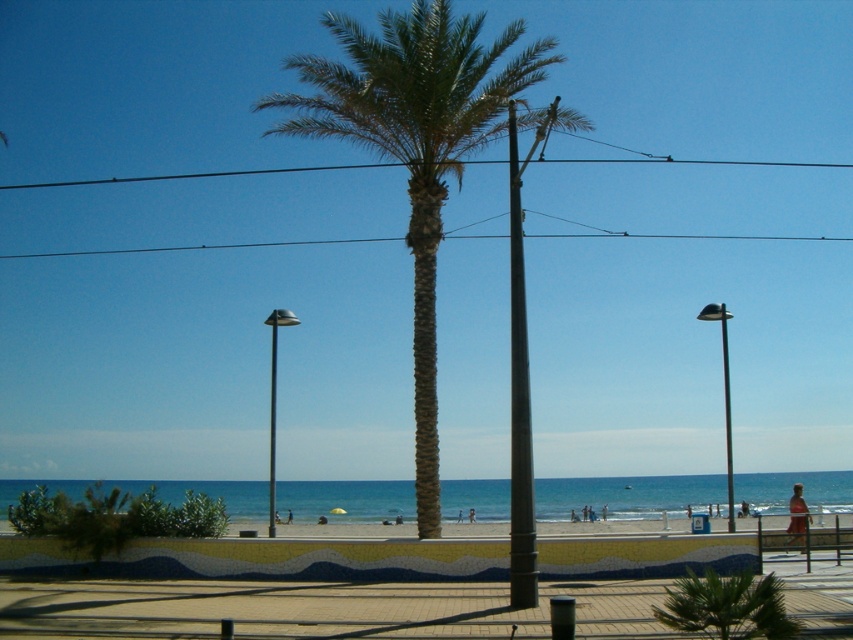
Does tan skin person at lower right have a lesser height compared to tan skin person at center?

No, tan skin person at lower right is not shorter than tan skin person at center.

Is tan skin person at lower right above tan skin person at center?

Yes, tan skin person at lower right is above tan skin person at center.

The image size is (853, 640). I want to click on tan skin person at lower right, so click(x=798, y=515).

What are the coordinates of `green textured palm tree at center` in the screenshot? It's located at (415, 147).

Is green textured palm tree at center behind tan skin person at beach center?

That is False.

Where is `green textured palm tree at center`? green textured palm tree at center is located at coordinates (415, 147).

Find the location of a particular element. green textured palm tree at center is located at coordinates (415, 147).

From the picture: Can you confirm if green textured palm tree at center is shorter than green leafy palm tree at center?

No.

Who is more forward, (285, 65) or (723, 620)?

Point (723, 620)

Is point (428, 464) farther from camera compared to point (732, 616)?

Yes, it is.

Identify the location of green textured palm tree at center. Image resolution: width=853 pixels, height=640 pixels. (415, 147).